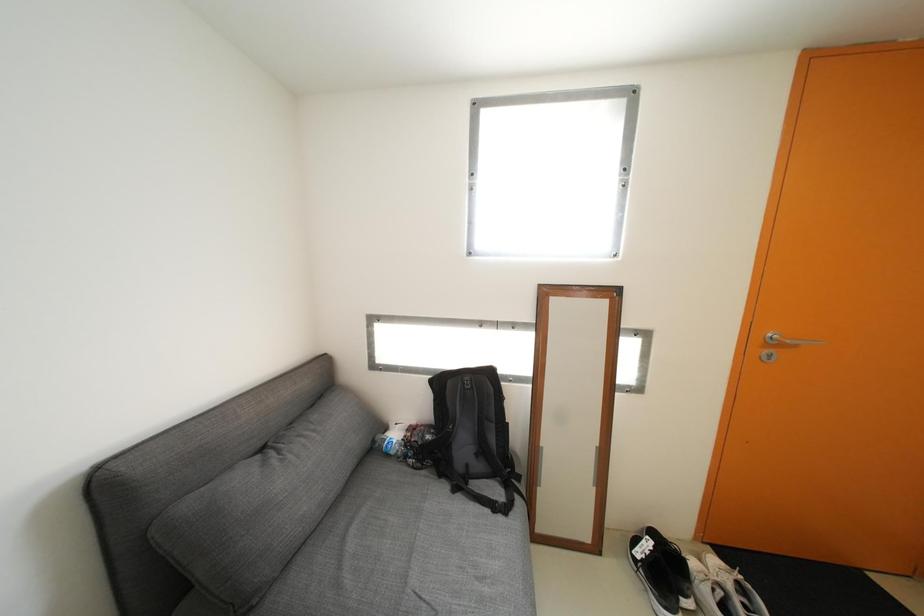
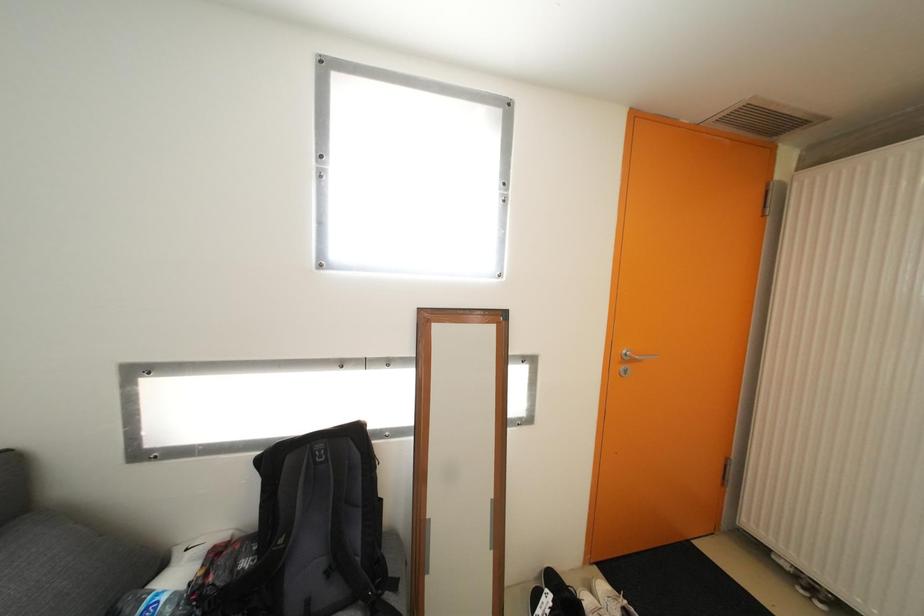
Question: Based on the continuous images, in which direction is the camera rotating? Reply with the corresponding letter.

Choices:
 (A) Left
 (B) Right
 (C) Up
 (D) Down

Answer: (B)